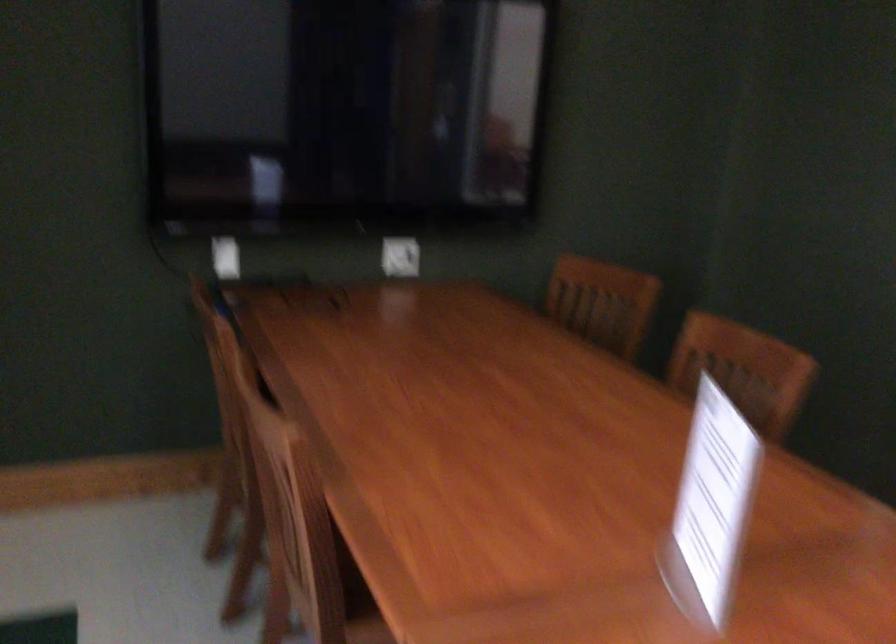
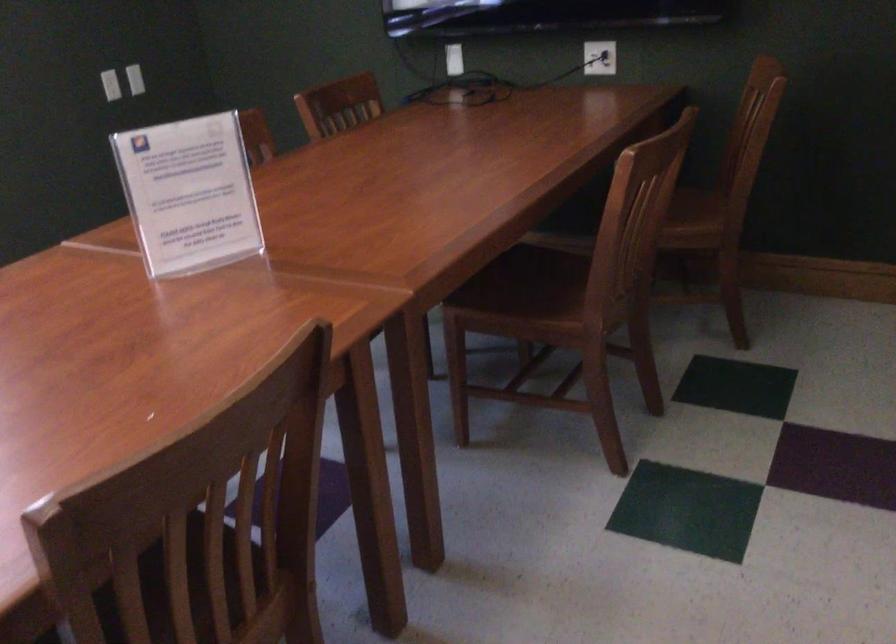
Locate, in the second image, the point that corresponds to point (418, 254) in the first image.

(599, 58)